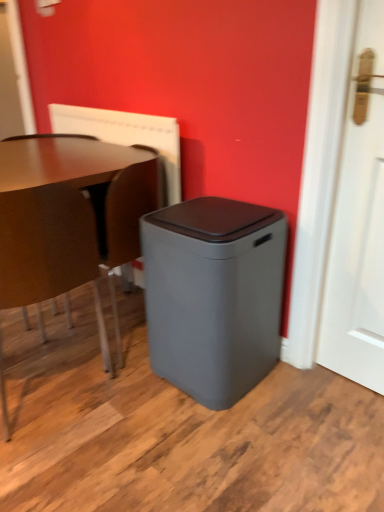
Question: From a real-world perspective, does white matte door at right sit lower than matte brown chair at left?

Choices:
 (A) no
 (B) yes

Answer: (A)

Question: From a real-world perspective, is white matte door at right physically above matte brown chair at left?

Choices:
 (A) yes
 (B) no

Answer: (A)

Question: Is white matte door at right thinner than matte brown chair at left?

Choices:
 (A) no
 (B) yes

Answer: (B)

Question: From the image's perspective, is white matte door at right under matte brown chair at left?

Choices:
 (A) no
 (B) yes

Answer: (A)

Question: Can you confirm if white matte door at right is wider than matte brown chair at left?

Choices:
 (A) yes
 (B) no

Answer: (B)

Question: Is white matte door at right facing towards matte brown chair at left?

Choices:
 (A) no
 (B) yes

Answer: (A)

Question: Is white textured radiator at upper center located within white matte door at right?

Choices:
 (A) no
 (B) yes

Answer: (A)

Question: Is white matte door at right not within white textured radiator at upper center?

Choices:
 (A) yes
 (B) no

Answer: (A)

Question: Is white matte door at right positioned with its back to white textured radiator at upper center?

Choices:
 (A) no
 (B) yes

Answer: (A)

Question: From the image's perspective, is white matte door at right located above white textured radiator at upper center?

Choices:
 (A) yes
 (B) no

Answer: (B)

Question: From a real-world perspective, does white matte door at right stand above white textured radiator at upper center?

Choices:
 (A) no
 (B) yes

Answer: (A)

Question: Does white matte door at right have a larger size compared to white textured radiator at upper center?

Choices:
 (A) no
 (B) yes

Answer: (B)

Question: Is brown leather swivel chair at lower left to the right of white textured radiator at upper center from the viewer's perspective?

Choices:
 (A) no
 (B) yes

Answer: (B)